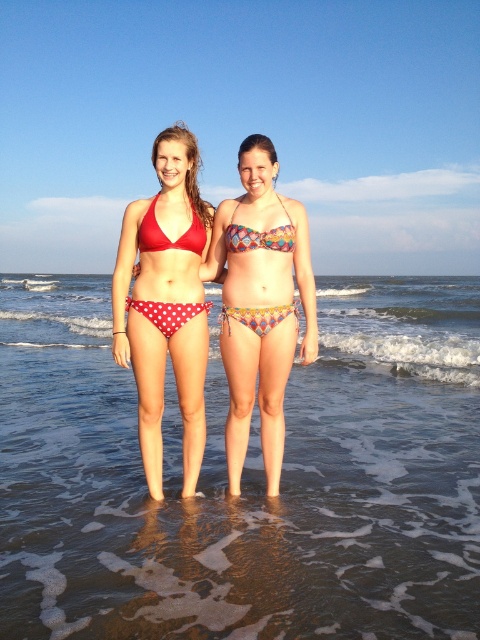
Does point (359, 531) come farther from viewer compared to point (267, 426)?

No, it is in front of (267, 426).

Can you confirm if clear water at lower center is positioned to the right of printed bikini top at center?

In fact, clear water at lower center is to the left of printed bikini top at center.

Who is more distant from viewer, (190, 632) or (279, 435)?

The point (279, 435) is more distant.

At what (x,y) coordinates should I click in order to perform the action: click on clear water at lower center. Please return your answer as a coordinate pair (x, y). Looking at the image, I should click on (244, 476).

How distant is polka dot matte bikini at center from multicolored printed bikini bottom at center?

The distance of polka dot matte bikini at center from multicolored printed bikini bottom at center is 20.58 inches.

The height and width of the screenshot is (640, 480). What do you see at coordinates (167, 236) in the screenshot?
I see `polka dot matte bikini at center` at bounding box center [167, 236].

The image size is (480, 640). In order to click on polka dot matte bikini at center in this screenshot , I will do `click(167, 236)`.

Does clear water at lower center have a greater width compared to polka dot matte bikini at center?

Yes.

Can you confirm if clear water at lower center is thinner than polka dot matte bikini at center?

In fact, clear water at lower center might be wider than polka dot matte bikini at center.

Locate an element on the screen. clear water at lower center is located at coordinates (244, 476).